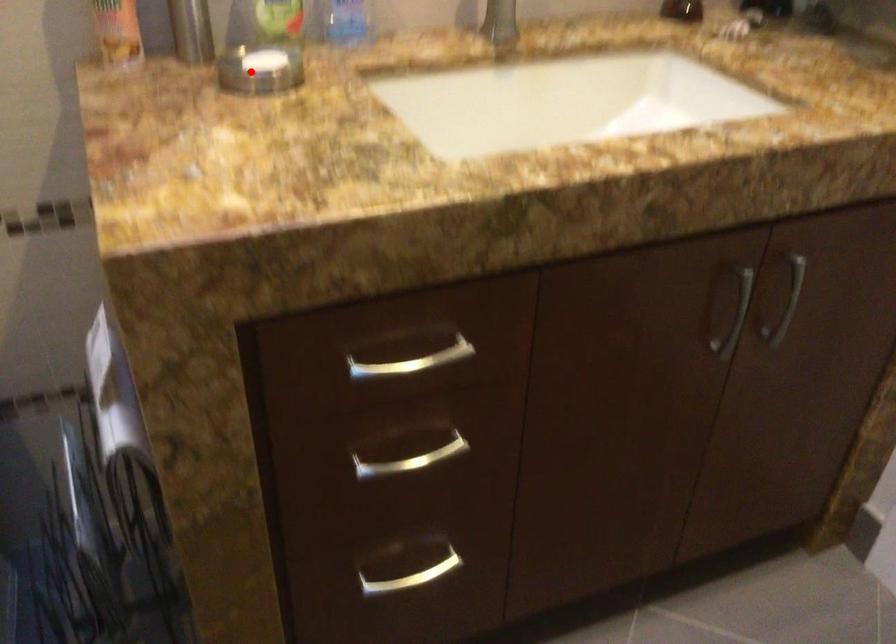
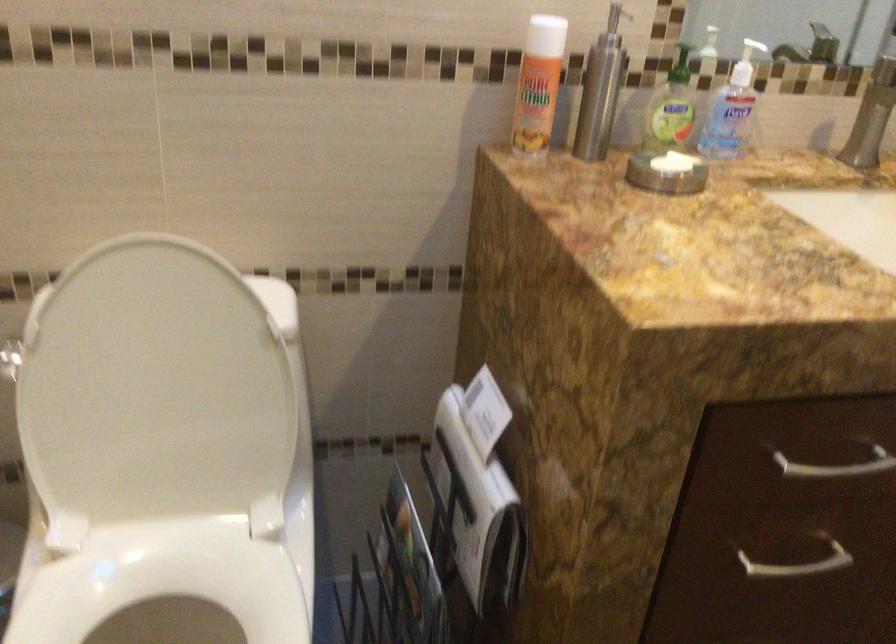
Find the pixel in the second image that matches the highlighted location in the first image.

(667, 172)